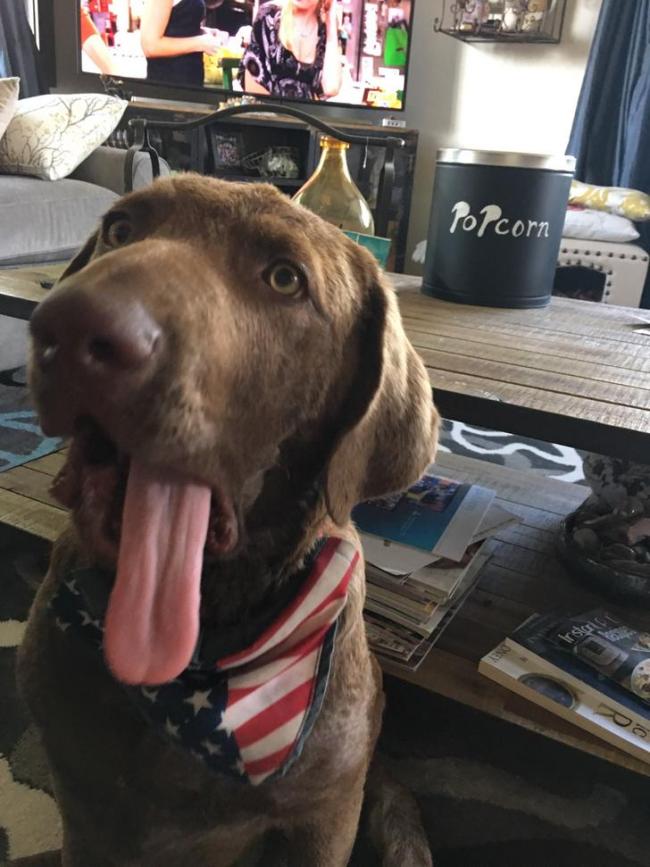
In order to click on gray, white and black rug on floor, seen between the table shelves in this screenshot , I will do `click(502, 446)`.